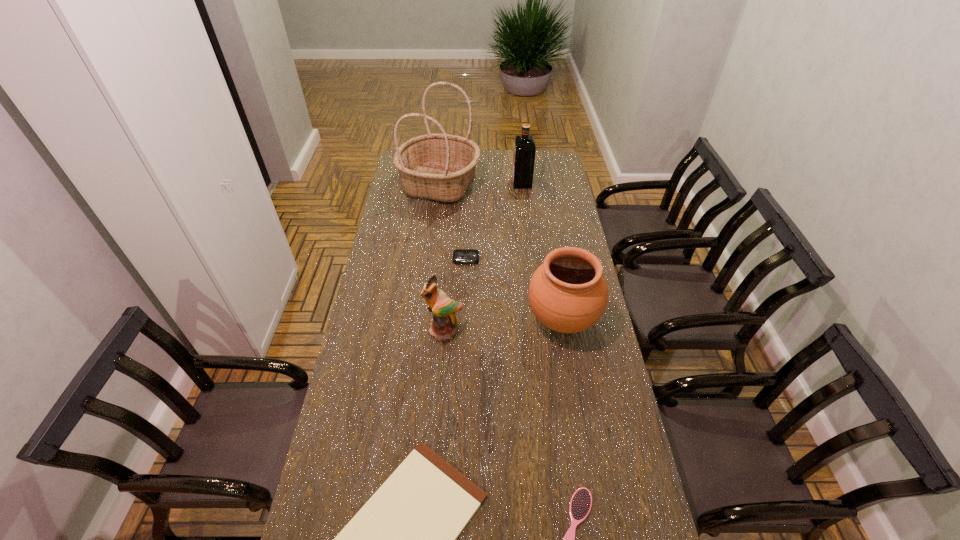
I want to click on the tallest object, so click(440, 167).

Where is `liquor`? liquor is located at coordinates (524, 145).

The image size is (960, 540). Identify the location of parrot. (443, 324).

Find the location of `pottery`. pottery is located at coordinates (568, 293).

Where is `the third shortest object`? Image resolution: width=960 pixels, height=540 pixels. the third shortest object is located at coordinates (460, 256).

Where is `the fifth nearest object`? the fifth nearest object is located at coordinates (460, 256).

The width and height of the screenshot is (960, 540). Identify the location of free space located on the front of the basket. (430, 267).

Image resolution: width=960 pixels, height=540 pixels. Find the location of `vacant position located on the front label of the liquor`. vacant position located on the front label of the liquor is located at coordinates (454, 183).

This screenshot has height=540, width=960. Identify the location of free space located on the front label of the liquor. (493, 183).

Find the location of a particular element. free space located 0.180m on the front label of the liquor is located at coordinates (477, 183).